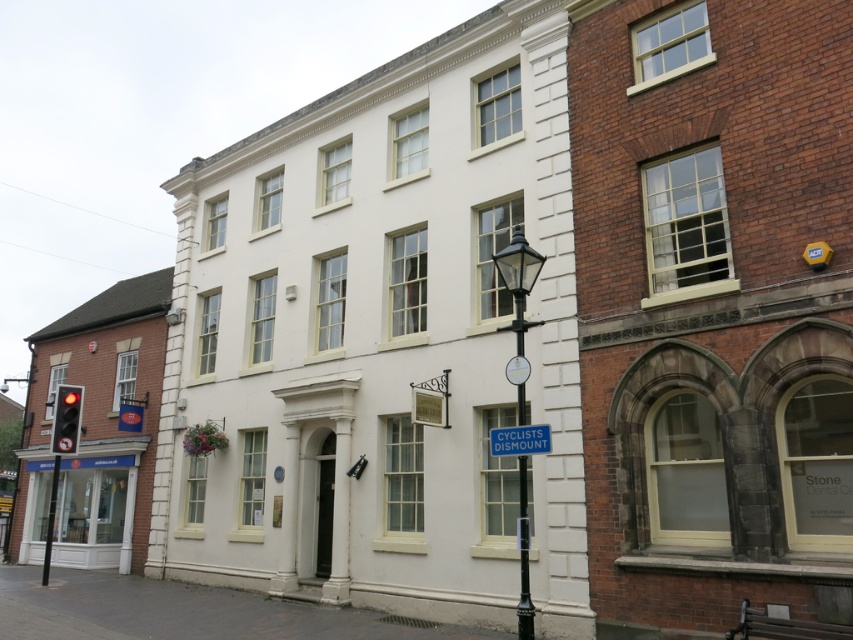
You are a pedestrian standing on the sidewalk and see the black polished metal streetlamp at center and the blue plastic sign at center. Which object is closer to you?

The black polished metal streetlamp at center is closer to you because the blue plastic sign at center is behind it.

You are a pedestrian standing on the sidewalk in front of the two buildings. You notice a green metallic pole at center and a blue plastic sign at center. Which object is located higher up from the ground?

The green metallic pole at center is positioned over the blue plastic sign at center, so it is higher up from the ground.